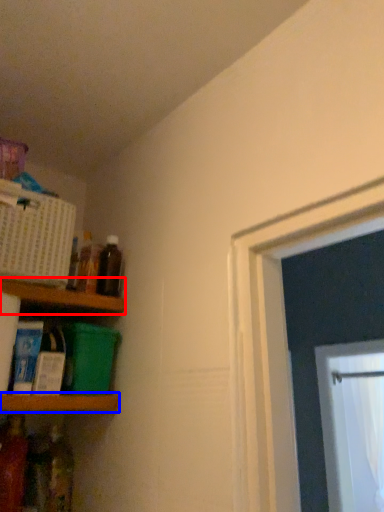
Question: Which point is closer to the camera, shelf (highlighted by a red box) or shelf (highlighted by a blue box)?

Choices:
 (A) shelf
 (B) shelf

Answer: (B)